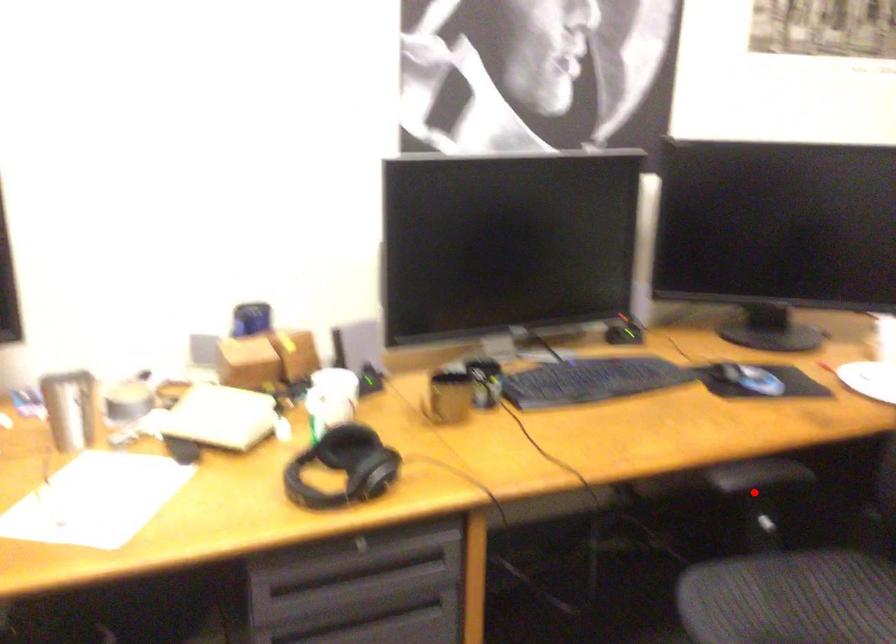
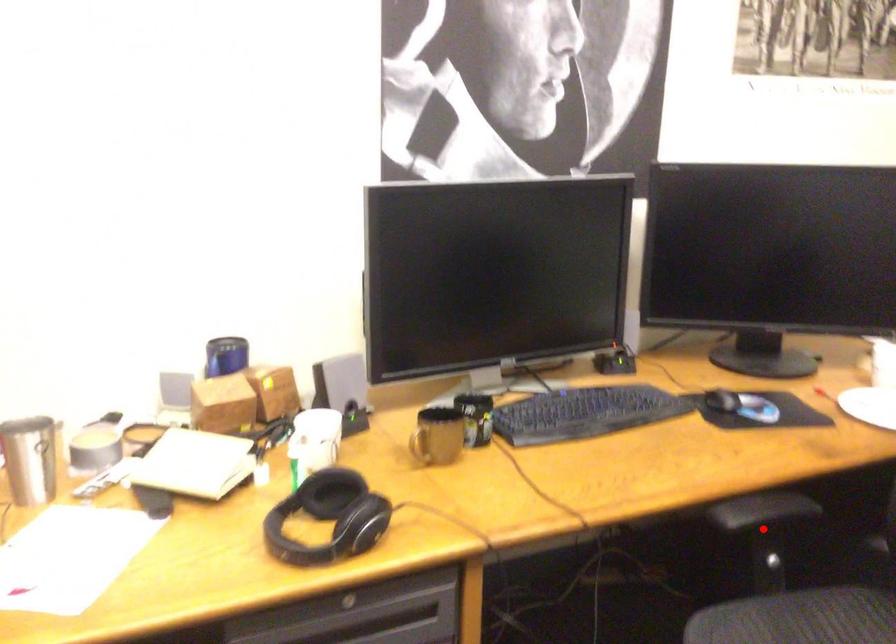
I am providing you with two images of the same scene from different viewpoints. A red point is marked on the first image and another point is marked on the second image. Is the red point in image1 aligned with the point shown in image2?

Yes